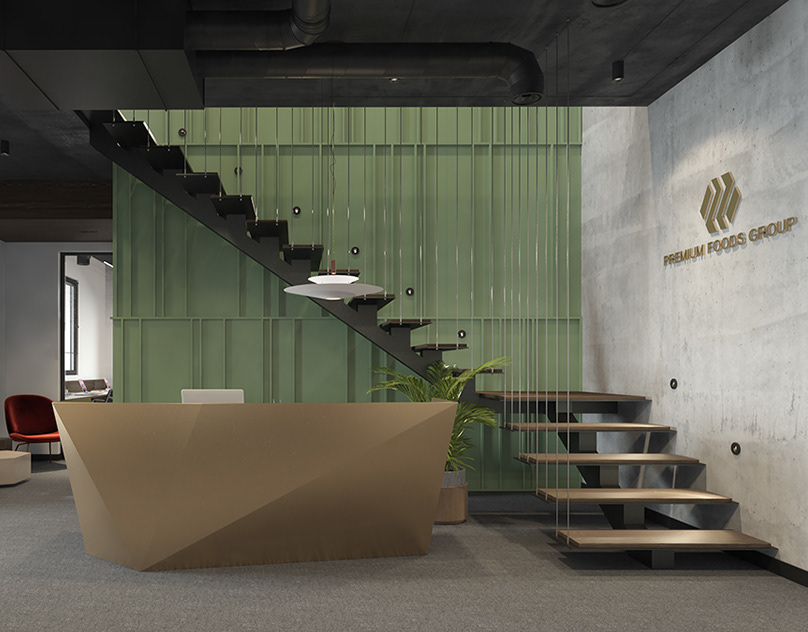
Find the location of a particular element. This screenshot has height=632, width=808. light is located at coordinates (330, 272).